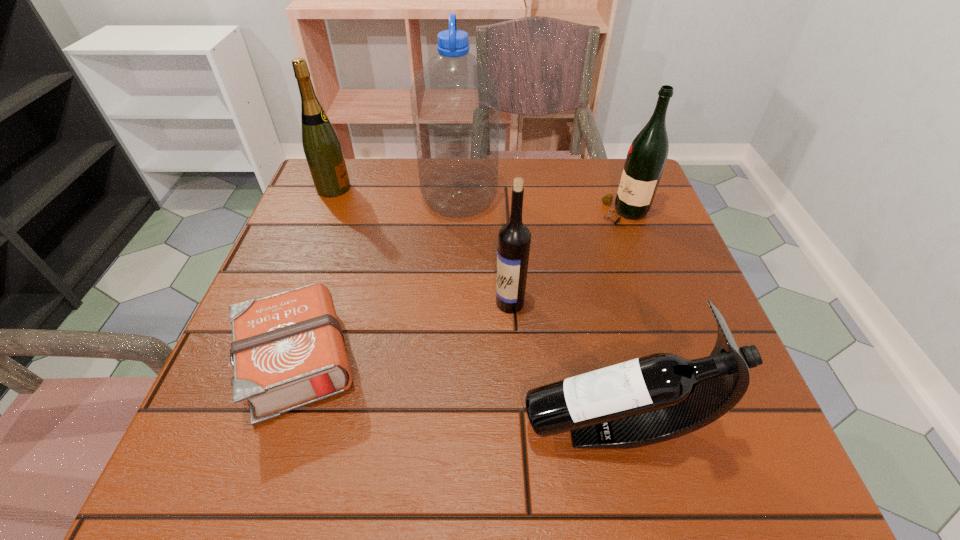
Image resolution: width=960 pixels, height=540 pixels. Find the location of `vacant space located 0.170m on the surface of the second farthest wine bottle`. vacant space located 0.170m on the surface of the second farthest wine bottle is located at coordinates (532, 212).

Where is `vacant space located 0.290m on the label of the second nearest wine bottle`? This screenshot has width=960, height=540. vacant space located 0.290m on the label of the second nearest wine bottle is located at coordinates (351, 303).

I want to click on vacant space located on the label of the second nearest wine bottle, so click(450, 303).

Where is `vacant space located on the label of the second nearest wine bottle`? The height and width of the screenshot is (540, 960). vacant space located on the label of the second nearest wine bottle is located at coordinates (326, 303).

Locate an element on the screen. free region located 0.190m on the stand of the nearest wine bottle is located at coordinates (403, 428).

This screenshot has height=540, width=960. What are the coordinates of `vacant space situated on the stand of the nearest wine bottle` in the screenshot? It's located at (459, 428).

The image size is (960, 540). What are the coordinates of `vacant space located on the stand of the nearest wine bottle` in the screenshot? It's located at (366, 428).

The width and height of the screenshot is (960, 540). Identify the location of free space located 0.120m on the right of the shortest object. (430, 361).

At what (x,y) coordinates should I click in order to perform the action: click on water jug present at the far edge. Please return your answer as a coordinate pair (x, y). This screenshot has width=960, height=540. Looking at the image, I should click on (455, 100).

This screenshot has width=960, height=540. Find the location of `object at the near edge`. object at the near edge is located at coordinates (662, 396).